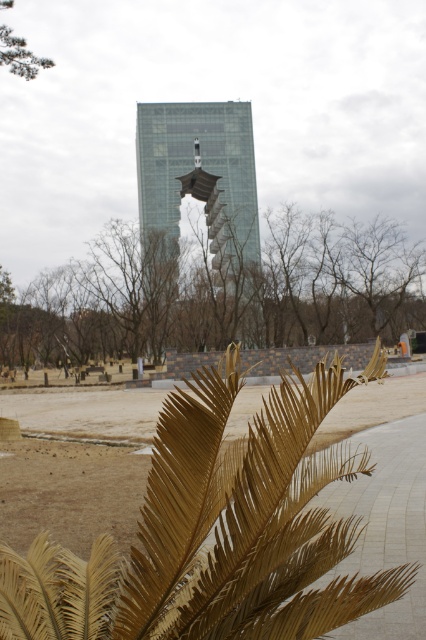
Question: Is brown leafy branch at center thinner than green leafy tree at upper left?

Choices:
 (A) no
 (B) yes

Answer: (A)

Question: Does gold textured palm leaf at lower center lie in front of transparent glass tower at center?

Choices:
 (A) no
 (B) yes

Answer: (B)

Question: Among these points, which one is nearest to the camera?

Choices:
 (A) (256, 218)
 (B) (176, 552)

Answer: (B)

Question: Which of the following is the closest to the observer?

Choices:
 (A) pos(146,608)
 (B) pos(252,248)
 (C) pos(123,234)

Answer: (A)

Question: Is transparent glass tower at center smaller than green leafy tree at upper left?

Choices:
 (A) yes
 (B) no

Answer: (B)

Question: Which object is closer to the camera taking this photo?

Choices:
 (A) green leafy tree at upper left
 (B) brown leafy branch at center
 (C) transparent glass tower at center

Answer: (A)